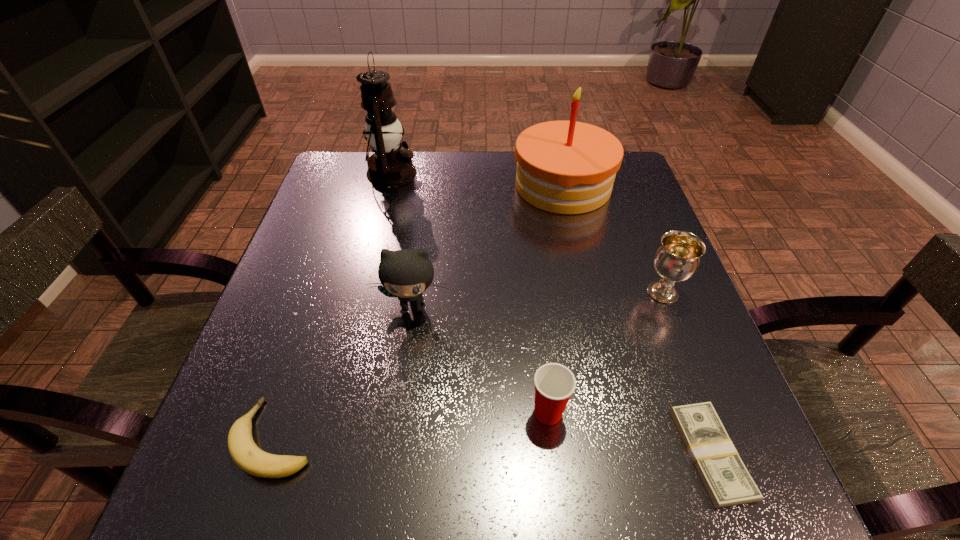
Image resolution: width=960 pixels, height=540 pixels. Identify the location of free space at the right edge of the desktop. (666, 426).

Find the location of a particular element. free space at the far left corner of the desktop is located at coordinates (345, 186).

Locate an element on the screen. This screenshot has width=960, height=540. vacant space at the near left corner is located at coordinates (236, 481).

The width and height of the screenshot is (960, 540). What are the coordinates of `free space between the second tallest object and the kitten` in the screenshot? It's located at (488, 246).

What are the coordinates of `vacant point located between the second shortest object and the kitten` in the screenshot? It's located at (344, 372).

This screenshot has width=960, height=540. I want to click on free spot between the chalice and the banana, so [x=469, y=365].

What are the coordinates of `empty location between the kitten and the sixth shortest object` in the screenshot? It's located at (488, 246).

The height and width of the screenshot is (540, 960). I want to click on free area in between the chalice and the kitten, so click(x=538, y=300).

Find the location of a particular element. The image size is (960, 540). vacant space that's between the fifth tallest object and the second shortest object is located at coordinates (412, 425).

This screenshot has width=960, height=540. Identify the location of free space between the kitten and the banana. (344, 372).